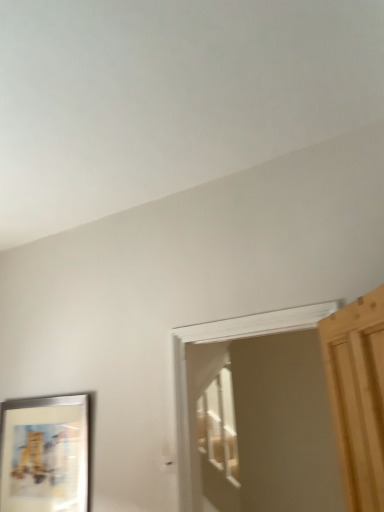
In the scene shown: Measure the distance between point (16, 448) and camera.

2.86 meters.

This screenshot has height=512, width=384. What do you see at coordinates (46, 454) in the screenshot?
I see `metallic silver picture frame at lower left` at bounding box center [46, 454].

At what (x,y) coordinates should I click in order to perform the action: click on metallic silver picture frame at lower left. Please return your answer as a coordinate pair (x, y). Looking at the image, I should click on (46, 454).

Locate an element on the screen. wooden screen door at center is located at coordinates (280, 428).

The width and height of the screenshot is (384, 512). What do you see at coordinates (280, 428) in the screenshot?
I see `wooden screen door at center` at bounding box center [280, 428].

Where is `metallic silver picture frame at lower left`? The width and height of the screenshot is (384, 512). metallic silver picture frame at lower left is located at coordinates (46, 454).

Does metallic silver picture frame at lower left appear on the left side of wooden screen door at center?

Correct, you'll find metallic silver picture frame at lower left to the left of wooden screen door at center.

Based on the photo, does metallic silver picture frame at lower left lie behind wooden screen door at center?

Yes, metallic silver picture frame at lower left is behind wooden screen door at center.

Which is less distant, (75, 416) or (258, 416)?

Positioned in front is point (75, 416).

From the image's perspective, is metallic silver picture frame at lower left over wooden screen door at center?

No, from the image's perspective, metallic silver picture frame at lower left is not above wooden screen door at center.

From a real-world perspective, is metallic silver picture frame at lower left beneath wooden screen door at center?

Correct, in the physical world, metallic silver picture frame at lower left is lower than wooden screen door at center.

Considering the relative sizes of metallic silver picture frame at lower left and wooden screen door at center in the image provided, is metallic silver picture frame at lower left wider than wooden screen door at center?

No.

Considering the relative sizes of metallic silver picture frame at lower left and wooden screen door at center in the image provided, is metallic silver picture frame at lower left taller than wooden screen door at center?

Incorrect, the height of metallic silver picture frame at lower left is not larger of that of wooden screen door at center.

Considering the relative sizes of metallic silver picture frame at lower left and wooden screen door at center in the image provided, is metallic silver picture frame at lower left bigger than wooden screen door at center?

No, metallic silver picture frame at lower left is not bigger than wooden screen door at center.

Is metallic silver picture frame at lower left positioned beyond the bounds of wooden screen door at center?

metallic silver picture frame at lower left lies outside wooden screen door at center's area.

Is metallic silver picture frame at lower left directly adjacent to wooden screen door at center?

metallic silver picture frame at lower left and wooden screen door at center are clearly separated.

Is metallic silver picture frame at lower left oriented towards wooden screen door at center?

No, metallic silver picture frame at lower left is not facing towards wooden screen door at center.

Can you tell me how much metallic silver picture frame at lower left and wooden screen door at center differ in facing direction?

There is a 0.197-degree angle between the facing directions of metallic silver picture frame at lower left and wooden screen door at center.

Where is `picture frame that appears on the left of wooden screen door at center`? This screenshot has height=512, width=384. picture frame that appears on the left of wooden screen door at center is located at coordinates (46, 454).

Considering the relative positions of wooden screen door at center and metallic silver picture frame at lower left in the image provided, is wooden screen door at center to the left of metallic silver picture frame at lower left from the viewer's perspective?

No.

Consider the image. Considering the positions of objects wooden screen door at center and metallic silver picture frame at lower left in the image provided, who is behind, wooden screen door at center or metallic silver picture frame at lower left?

metallic silver picture frame at lower left is more distant.

Is point (299, 409) closer or farther from the camera than point (5, 493)?

Point (299, 409) appears to be farther away from the viewer than point (5, 493).

From the image's perspective, does wooden screen door at center appear higher than metallic silver picture frame at lower left?

Correct, wooden screen door at center appears higher than metallic silver picture frame at lower left in the image.

From a real-world perspective, which object rests below the other?

metallic silver picture frame at lower left.

Looking at their sizes, would you say wooden screen door at center is wider or thinner than metallic silver picture frame at lower left?

Considering their sizes, wooden screen door at center looks broader than metallic silver picture frame at lower left.

In the scene shown: Does wooden screen door at center have a lesser height compared to metallic silver picture frame at lower left?

No, wooden screen door at center is not shorter than metallic silver picture frame at lower left.

Is wooden screen door at center smaller than metallic silver picture frame at lower left?

Actually, wooden screen door at center might be larger than metallic silver picture frame at lower left.

Is metallic silver picture frame at lower left located within wooden screen door at center?

That's incorrect, metallic silver picture frame at lower left is not inside wooden screen door at center.

Is wooden screen door at center not close to metallic silver picture frame at lower left?

Absolutely, wooden screen door at center is distant from metallic silver picture frame at lower left.

Is wooden screen door at center oriented towards metallic silver picture frame at lower left?

No, wooden screen door at center does not turn towards metallic silver picture frame at lower left.

At what (x,y) coordinates should I click in order to perform the action: click on screen door above the metallic silver picture frame at lower left (from a real-world perspective). Please return your answer as a coordinate pair (x, y). This screenshot has width=384, height=512. Looking at the image, I should click on (280, 428).

The image size is (384, 512). What are the coordinates of `picture frame located on the left of wooden screen door at center` in the screenshot? It's located at (46, 454).

You are a GUI agent. You are given a task and a screenshot of the screen. Output one action in this format:
    pyautogui.click(x=<x>, y=<y>)
    Task: Click on the screen door that is above the metallic silver picture frame at lower left (from the image's perspective)
    
    Given the screenshot: What is the action you would take?
    pyautogui.click(x=280, y=428)